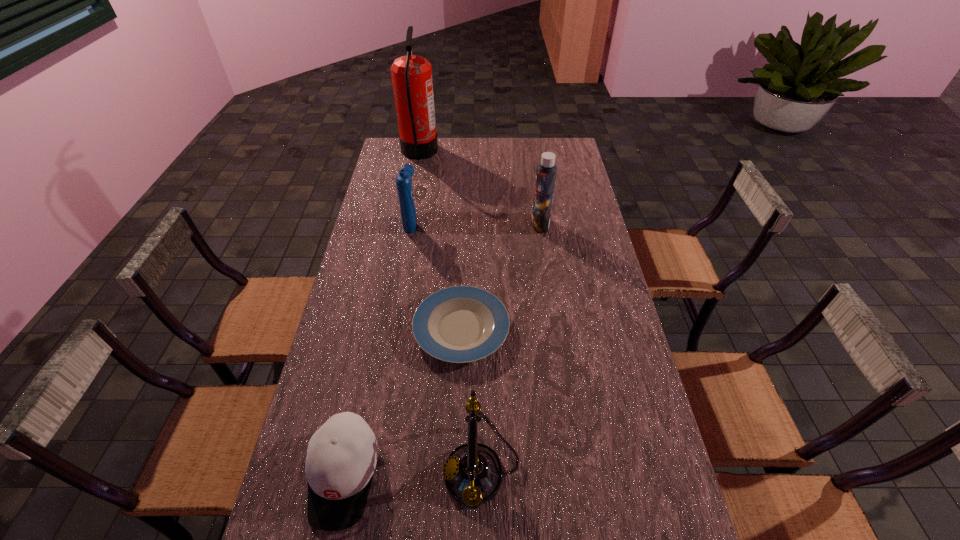
The width and height of the screenshot is (960, 540). In order to click on fire extinguisher located in the left edge section of the desktop in this screenshot , I will do `click(411, 75)`.

Where is `shampoo that is positioned at the left edge`? shampoo that is positioned at the left edge is located at coordinates (403, 179).

You are a GUI agent. You are given a task and a screenshot of the screen. Output one action in this format:
    pyautogui.click(x=<x>, y=<y>)
    Task: Click on the baseball cap at the left edge
    The height and width of the screenshot is (540, 960).
    Given the screenshot: What is the action you would take?
    pyautogui.click(x=341, y=458)

Find the location of a particular element. Image resolution: width=960 pixels, height=540 pixels. object that is at the far left corner is located at coordinates (411, 75).

Where is `free space at the far edge of the desktop`? free space at the far edge of the desktop is located at coordinates (530, 149).

This screenshot has width=960, height=540. I want to click on blank area at the left edge, so click(378, 226).

Locate an element on the screen. This screenshot has width=960, height=540. free space at the right edge of the desktop is located at coordinates (592, 361).

Identify the location of vacant space at the far left corner of the desktop. The image size is (960, 540). (388, 153).

Identify the location of free area in between the shorter shampoo and the second shortest object. (377, 348).

At what (x,y) coordinates should I click in order to perform the action: click on vacant area that lies between the second shortest object and the shortest object. Please return your answer as a coordinate pair (x, y). Looking at the image, I should click on (402, 402).